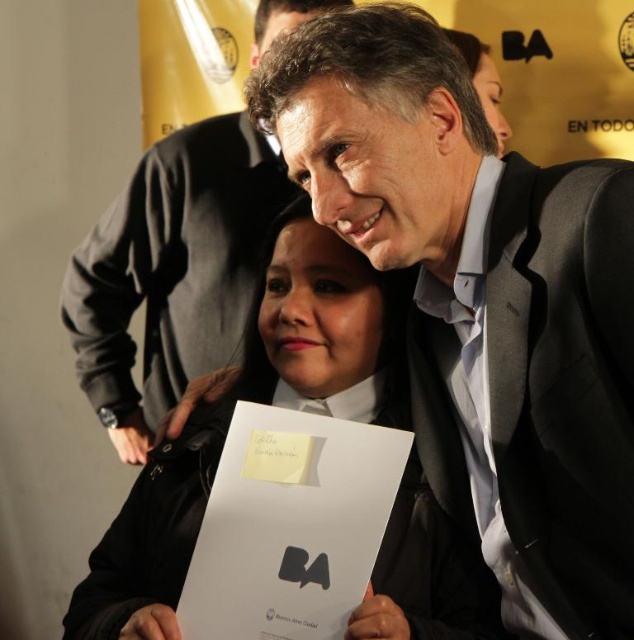
In the image of the formal event with a yellow banner and two people, there is a point marked at coordinates (536, 392). What does this point indicate?

The point at coordinates (536, 392) marks the location of the dark gray suit at center.

You are a photographer at the event and need to adjust the lighting between the black suit at center and the dark gray suit at center. Given their proximity, will you need to focus on a single light source or multiple sources to ensure both suits are well lit?

The black suit at center is 1.49 inches away from dark gray suit at center, so they are very close. You can focus on a single light source to ensure both suits are well lit.

Consider the image. You are a photographer at the event and need to position a spotlight exactly at the center of the black suit at center. According to the coordinates provided, where should you aim the spotlight?

The spotlight should be aimed at the coordinates point (482, 301) to hit the center of the black suit at center.